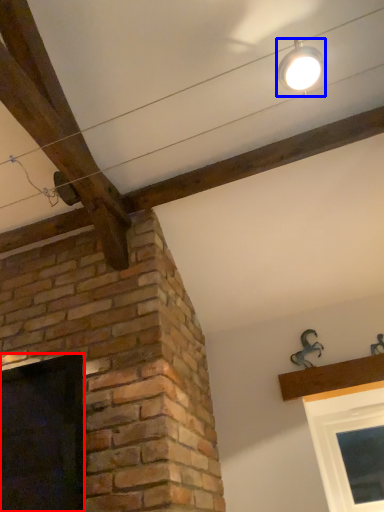
Question: Which point is closer to the camera, window (highlighted by a red box) or light fixture (highlighted by a blue box)?

Choices:
 (A) window
 (B) light fixture

Answer: (B)